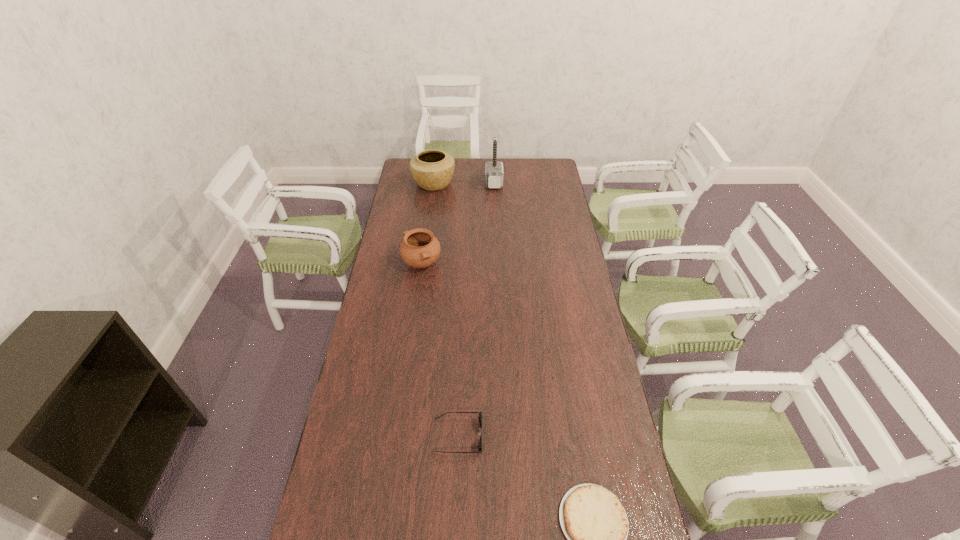
You are a GUI agent. You are given a task and a screenshot of the screen. Output one action in this format:
    pyautogui.click(x=<x>, y=<y>)
    Task: Click on the hammer
    The height and width of the screenshot is (540, 960).
    Given the screenshot: What is the action you would take?
    pyautogui.click(x=494, y=174)

I want to click on the tallest object, so click(x=494, y=174).

Where is `the farther pottery`? This screenshot has height=540, width=960. the farther pottery is located at coordinates (432, 170).

What are the coordinates of `the nearer pottery` in the screenshot? It's located at pos(419,249).

Image resolution: width=960 pixels, height=540 pixels. Identify the location of sunglasses. (480, 413).

Where is `the fourth tallest object`? The width and height of the screenshot is (960, 540). the fourth tallest object is located at coordinates (480, 413).

The image size is (960, 540). I want to click on free point located for striking with the head of the hammer, so click(x=412, y=183).

The height and width of the screenshot is (540, 960). I want to click on free location located 0.300m for striking with the head of the hammer, so click(430, 183).

At what (x,y) coordinates should I click in order to perform the action: click on vacant area situated 0.100m for striking with the head of the hammer. Please return your answer as a coordinate pair (x, y). Image resolution: width=960 pixels, height=540 pixels. Looking at the image, I should click on (467, 183).

I want to click on vacant space positioned on the right of the farther pottery, so click(x=518, y=183).